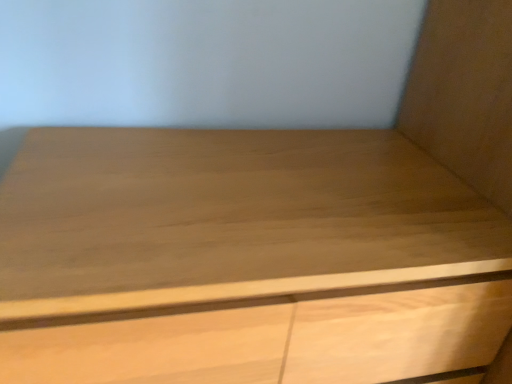
Find the location of a particular element. The width and height of the screenshot is (512, 384). vacant space situated above light wood chest of drawers at center (from a real-world perspective) is located at coordinates (258, 180).